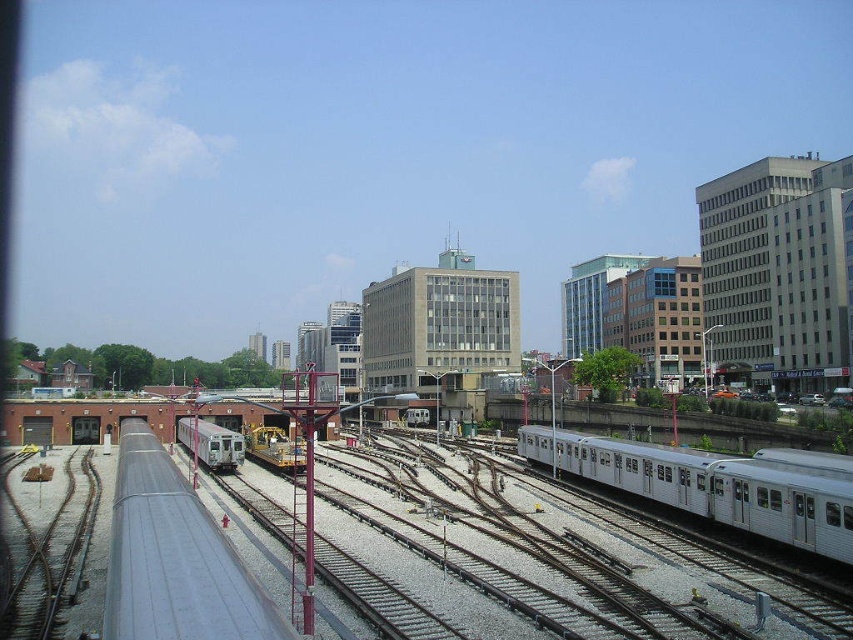
You are a railway engineer assessing the layout of the yard. You need to determine if the silver metallic train at right can fit on the gray metallic track at lower left. Based on their sizes, what is your conclusion?

The silver metallic train at right is smaller than the gray metallic track at lower left, so it can fit on the track.

You are standing in the urban railway yard and want to reach a specific point marked at coordinates point (73, 504). If your maximum comfortable walking distance is 50 meters, can you comfortably walk to this point without needing assistance?

The distance of point (73, 504) from viewer is 52.82 meters, which exceeds your maximum comfortable walking distance of 50 meters. Therefore, you may need assistance or a vehicle to reach this point comfortably.

You are a railway worker who needs to direct a third train to the maintenance area located at the far left of the image. The maintenance area is only accessible via the path between the silver metallic train at right and the silver metallic train at lower left. Can you fit the third train through this path?

The silver metallic train at right is positioned on the right side of the silver metallic train at lower left, so the path between them is narrow. However, since both trains are silver metallic and likely standard size, the third train should be able to pass through the path between them if there is sufficient clearance. However, without specific measurements, it is recommended to check the exact dimensions before proceeding.